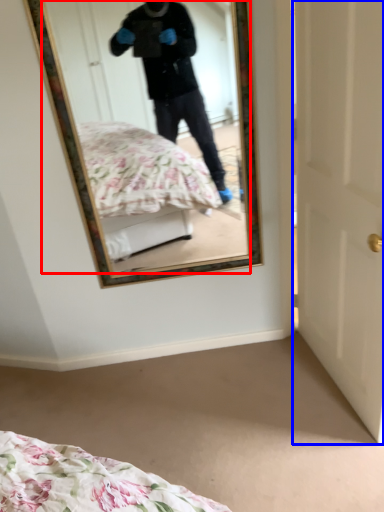
Question: Which point is closer to the camera, mirror (highlighted by a red box) or door (highlighted by a blue box)?

Choices:
 (A) mirror
 (B) door

Answer: (B)